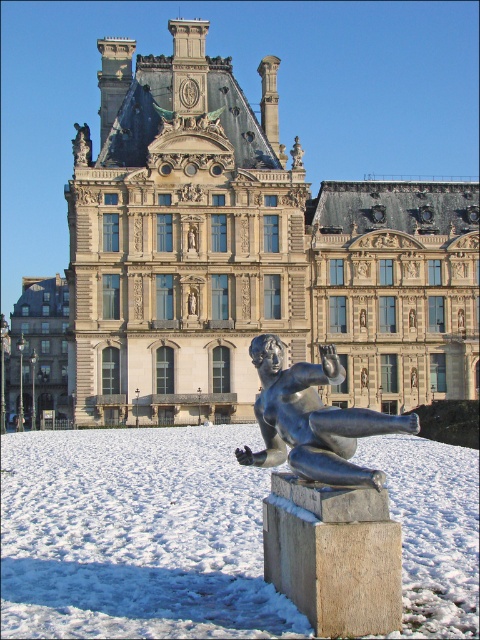
From the picture: Is white snow at center taller than polished bronze statue at center?

Incorrect, white snow at center's height is not larger of polished bronze statue at center's.

Is white snow at center wider than polished bronze statue at center?

Yes.

Describe the element at coordinates (135, 536) in the screenshot. This screenshot has width=480, height=640. I see `white snow at center` at that location.

This screenshot has height=640, width=480. I want to click on white snow at center, so pyautogui.click(x=135, y=536).